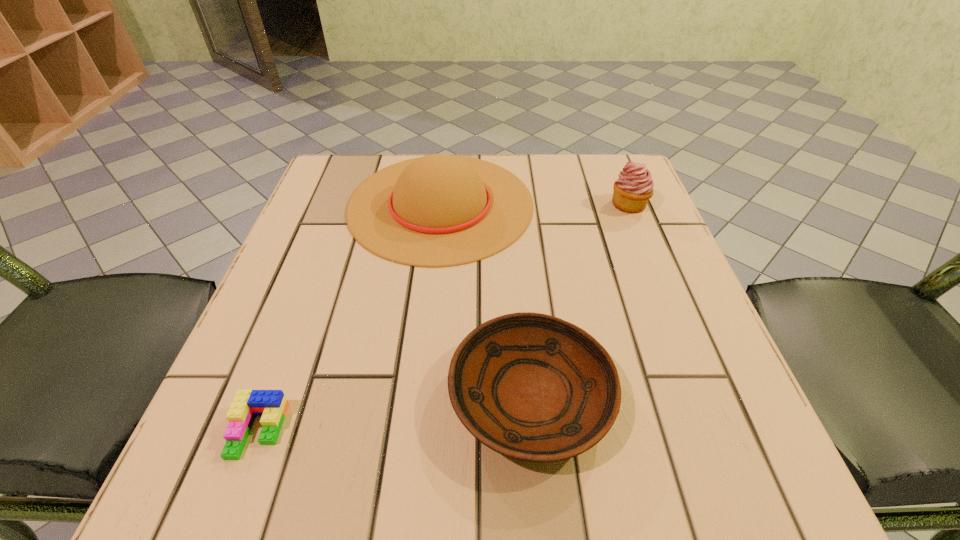
Identify the location of sombrero. This screenshot has height=540, width=960. (440, 210).

This screenshot has height=540, width=960. I want to click on cupcake, so click(631, 192).

Where is `plate`? The image size is (960, 540). plate is located at coordinates (532, 387).

Find the location of a particular element. The height and width of the screenshot is (540, 960). the shortest object is located at coordinates (271, 405).

Locate an element on the screen. This screenshot has height=540, width=960. free spot located 0.390m on the front of the sombrero is located at coordinates (411, 482).

Where is `vacant space located 0.180m on the back of the rightmost object`? The width and height of the screenshot is (960, 540). vacant space located 0.180m on the back of the rightmost object is located at coordinates tap(609, 153).

The width and height of the screenshot is (960, 540). I want to click on vacant area situated 0.140m on the left of the third tallest object, so click(x=353, y=396).

Identify the location of vacant space situated on the back of the Lego. (322, 261).

Locate an element on the screen. sombrero that is at the far edge is located at coordinates (440, 210).

Identify the location of cupcake that is positioned at the far edge. This screenshot has width=960, height=540. (631, 192).